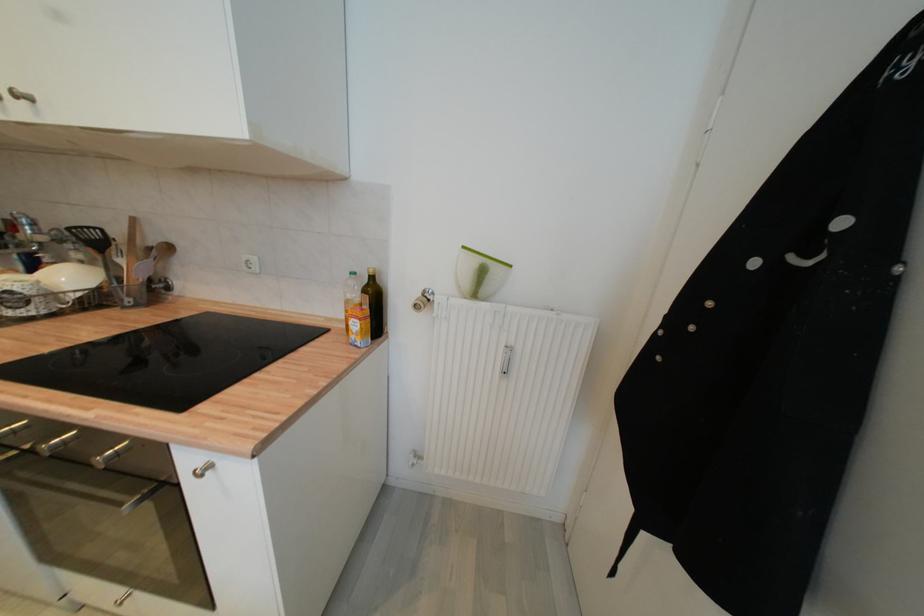
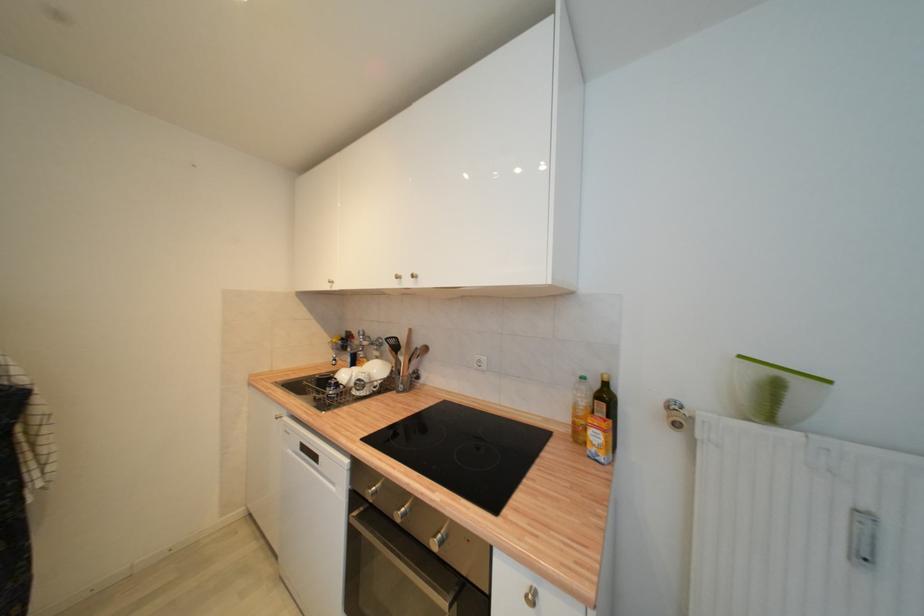
Locate, in the second image, the point that corresponds to pixel 468 249 in the first image.

(746, 359)